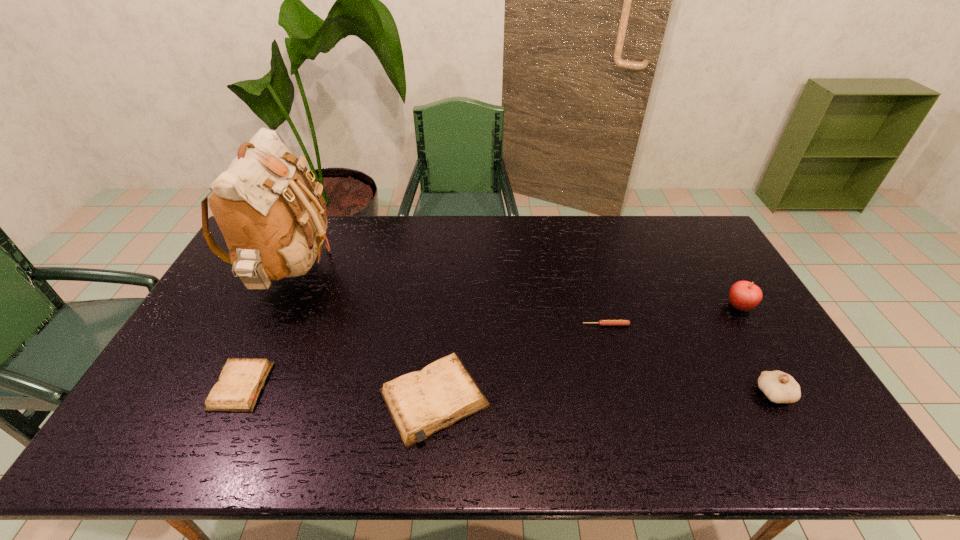
Identify the location of the left diary. (240, 383).

Where is `the shorter diary`? Image resolution: width=960 pixels, height=540 pixels. the shorter diary is located at coordinates (240, 383).

Identify the location of the fourth tallest object. (421, 403).

What are the coordinates of `the fourth object from right to left` in the screenshot? It's located at (421, 403).

The width and height of the screenshot is (960, 540). I want to click on the tallest object, so click(273, 225).

Identify the location of apple. (743, 295).

Locate an element on the screen. This screenshot has width=960, height=540. the fourth nearest object is located at coordinates (601, 322).

You are a GUI agent. You are given a task and a screenshot of the screen. Output one action in this format:
    pyautogui.click(x=<x>, y=<y>)
    Task: Click on the third object from right to left
    Image resolution: width=960 pixels, height=540 pixels.
    Given the screenshot: What is the action you would take?
    pyautogui.click(x=601, y=322)

At what (x,y) coordinates should I click in order to perform the action: click on garlic. Please return your answer as a coordinate pair (x, y). The image size is (960, 540). Looking at the image, I should click on (779, 387).

The height and width of the screenshot is (540, 960). What are the coordinates of `free space located on the back of the shorter diary` in the screenshot? It's located at (266, 332).